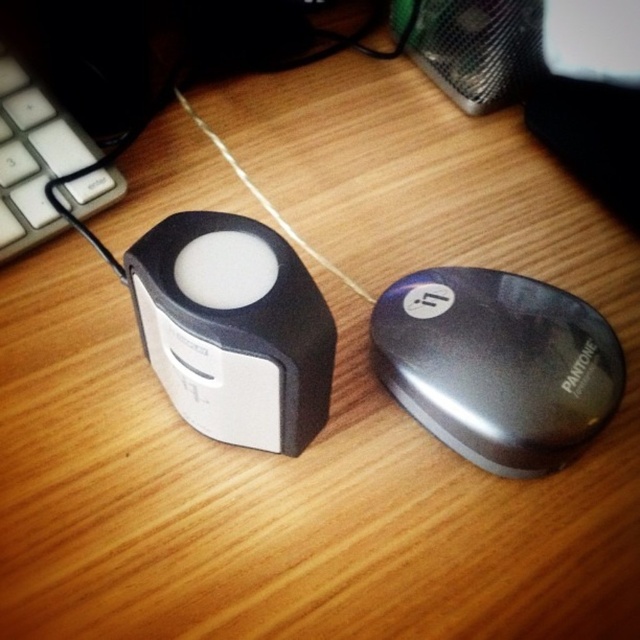
You are setting up a home office and need to place both the satin black mouse at center and the matte black speaker at center on your desk. Given their sizes, which device should you place closer to the edge of the desk to ensure there is enough space for both?

The satin black mouse at center is shorter than the matte black speaker at center, so you should place the satin black mouse at center closer to the edge of the desk to accommodate the larger speaker.

You are setting up a home office and want to place both the satin black mouse at center and the matte black speaker at center on your desk. If you have limited space and need to choose which one to place closer to the edge to save space, which device should you choose?

The satin black mouse at center is smaller than the matte black speaker at center, so you should place the satin black mouse at center closer to the edge to save space.